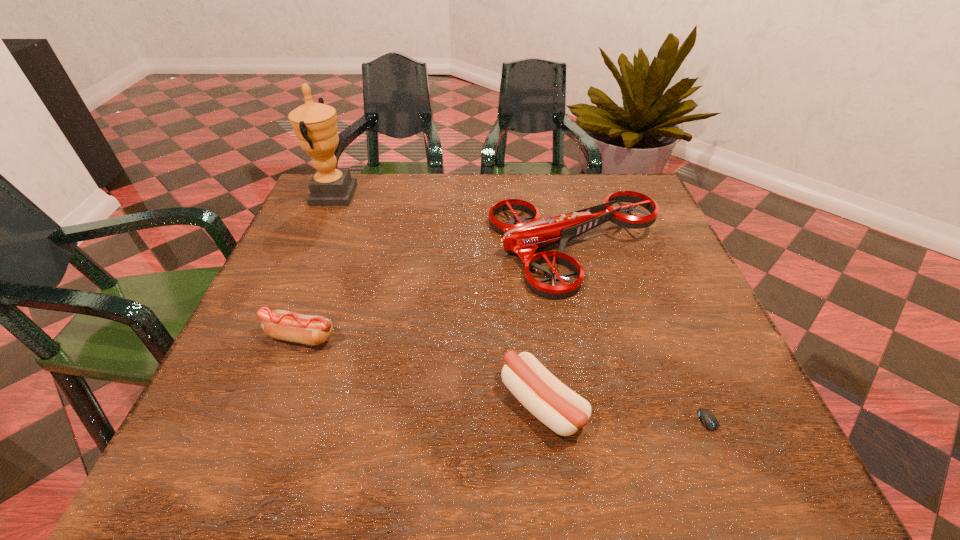
Where is `object located at the far right corner`? The height and width of the screenshot is (540, 960). object located at the far right corner is located at coordinates (523, 239).

The image size is (960, 540). I want to click on object that is at the near right corner, so click(x=708, y=419).

Locate an element on the screen. The width and height of the screenshot is (960, 540). vacant space at the far edge is located at coordinates (525, 216).

Locate an element on the screen. Image resolution: width=960 pixels, height=540 pixels. vacant region at the near edge of the desktop is located at coordinates (366, 440).

The image size is (960, 540). I want to click on free spot at the left edge of the desktop, so click(x=359, y=227).

Locate an element on the screen. The width and height of the screenshot is (960, 540). vacant area at the right edge is located at coordinates (727, 406).

Where is `free space at the far left corner`? free space at the far left corner is located at coordinates (359, 194).

In the image, there is a desktop. Where is `vacant area at the near left corner`? Image resolution: width=960 pixels, height=540 pixels. vacant area at the near left corner is located at coordinates (281, 437).

Identify the location of free space between the award and the fourth shortest object. (454, 222).

Identify the location of vacant space that's between the third nearest object and the second tallest object. (438, 293).